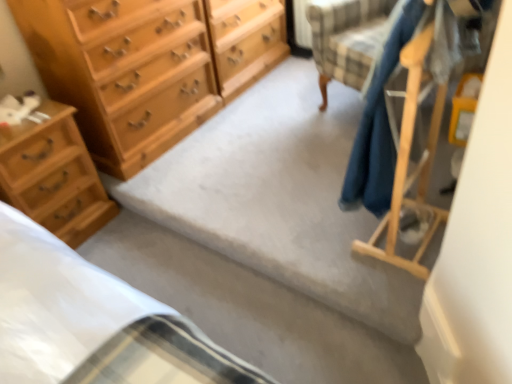
Image resolution: width=512 pixels, height=384 pixels. I want to click on light brown wood chest of drawers at left, the second chest of drawers in the top-to-bottom sequence, so click(53, 176).

Image resolution: width=512 pixels, height=384 pixels. Find the location of `the chest of drawers that appears in front of the light wood chest of drawers at left, acting as the second chest of drawers starting from the bottom`. the chest of drawers that appears in front of the light wood chest of drawers at left, acting as the second chest of drawers starting from the bottom is located at coordinates (53, 176).

Between point (137, 143) and point (53, 222), which one is positioned in front?

The point (53, 222) is closer to the camera.

Is light brown wood chest of drawers at left, the second chest of drawers in the top-to-bottom sequence, at the back of light wood chest of drawers at left, acting as the second chest of drawers starting from the bottom?

light wood chest of drawers at left, acting as the second chest of drawers starting from the bottom, is not turned away from light brown wood chest of drawers at left, the second chest of drawers in the top-to-bottom sequence.

Who is taller, wooden coat rack at right or light brown wood chest of drawers at left, the second chest of drawers in the top-to-bottom sequence?

wooden coat rack at right is taller.

Can you confirm if wooden coat rack at right is thinner than light brown wood chest of drawers at left, the 1th chest of drawers from the bottom?

No, wooden coat rack at right is not thinner than light brown wood chest of drawers at left, the 1th chest of drawers from the bottom.

From the image's perspective, is wooden coat rack at right positioned above or below light brown wood chest of drawers at left, the 1th chest of drawers from the bottom?

Based on their image positions, wooden coat rack at right is located above light brown wood chest of drawers at left, the 1th chest of drawers from the bottom.

Is light brown wood chest of drawers at left, the second chest of drawers in the top-to-bottom sequence, in front of or behind wooden coat rack at right in the image?

light brown wood chest of drawers at left, the second chest of drawers in the top-to-bottom sequence, is behind wooden coat rack at right.

Which point is more distant from viewer, (22, 185) or (386, 238)?

The point (22, 185) is behind.

Is light brown wood chest of drawers at left, the second chest of drawers in the top-to-bottom sequence, in contact with wooden coat rack at right?

No.

What's the angular difference between light brown wood chest of drawers at left, the second chest of drawers in the top-to-bottom sequence, and wooden coat rack at right's facing directions?

The angle between the facing direction of light brown wood chest of drawers at left, the second chest of drawers in the top-to-bottom sequence, and the facing direction of wooden coat rack at right is 178 degrees.

Does point (424, 200) come in front of point (306, 183)?

That is True.

Image resolution: width=512 pixels, height=384 pixels. Identify the location of concrete behind the wooden coat rack at right. (280, 197).

From the image's perspective, would you say wooden coat rack at right is positioned over carpet at center?

No, from the image's perspective, wooden coat rack at right is not on top of carpet at center.

Is light wood chest of drawers at left, the first chest of drawers in the top-to-bottom sequence, with wooden coat rack at right?

light wood chest of drawers at left, the first chest of drawers in the top-to-bottom sequence, is not next to wooden coat rack at right, and they're not touching.

Considering the sizes of light wood chest of drawers at left, the first chest of drawers in the top-to-bottom sequence, and wooden coat rack at right in the image, is light wood chest of drawers at left, the first chest of drawers in the top-to-bottom sequence, bigger or smaller than wooden coat rack at right?

In the image, light wood chest of drawers at left, the first chest of drawers in the top-to-bottom sequence, appears to be larger than wooden coat rack at right.

Consider the image. Can you tell me how much light wood chest of drawers at left, acting as the second chest of drawers starting from the bottom, and wooden coat rack at right differ in facing direction?

The angle between the facing direction of light wood chest of drawers at left, acting as the second chest of drawers starting from the bottom, and the facing direction of wooden coat rack at right is 178 degrees.

Is light wood chest of drawers at left, the first chest of drawers in the top-to-bottom sequence, not within wooden coat rack at right?

light wood chest of drawers at left, the first chest of drawers in the top-to-bottom sequence, lies outside wooden coat rack at right's area.

From a real-world perspective, is light brown wood chest of drawers at left, the second chest of drawers in the top-to-bottom sequence, on top of carpet at center?

Indeed, from a real-world perspective, light brown wood chest of drawers at left, the second chest of drawers in the top-to-bottom sequence, stands above carpet at center.

Is light brown wood chest of drawers at left, the 1th chest of drawers from the bottom, in front of or behind carpet at center in the image?

light brown wood chest of drawers at left, the 1th chest of drawers from the bottom, is positioned farther from the viewer than carpet at center.

Could carpet at center be considered to be inside light brown wood chest of drawers at left, the second chest of drawers in the top-to-bottom sequence?

No, carpet at center is not a part of light brown wood chest of drawers at left, the second chest of drawers in the top-to-bottom sequence.

Between light brown wood chest of drawers at left, the second chest of drawers in the top-to-bottom sequence, and carpet at center, which one has less height?

Standing shorter between the two is carpet at center.

How different are the orientations of wooden coat rack at right and light wood chest of drawers at left, the first chest of drawers in the top-to-bottom sequence, in degrees?

They differ by 178 degrees in their facing directions.

Is wooden coat rack at right aimed at light wood chest of drawers at left, the first chest of drawers in the top-to-bottom sequence?

Yes, wooden coat rack at right is aimed at light wood chest of drawers at left, the first chest of drawers in the top-to-bottom sequence.

From a real-world perspective, is wooden coat rack at right on top of light wood chest of drawers at left, the first chest of drawers in the top-to-bottom sequence?

Correct, in the physical world, wooden coat rack at right is higher than light wood chest of drawers at left, the first chest of drawers in the top-to-bottom sequence.

Identify the location of the chest of drawers above the light brown wood chest of drawers at left, the 1th chest of drawers from the bottom (from a real-world perspective). (147, 67).

Locate an element on the screen. Image resolution: width=512 pixels, height=384 pixels. furniture that appears in front of the light brown wood chest of drawers at left, the 1th chest of drawers from the bottom is located at coordinates (408, 162).

When comparing their distances from light brown wood chest of drawers at left, the second chest of drawers in the top-to-bottom sequence, does wooden coat rack at right or light wood chest of drawers at left, acting as the second chest of drawers starting from the bottom, seem further?

The object further to light brown wood chest of drawers at left, the second chest of drawers in the top-to-bottom sequence, is wooden coat rack at right.

From the image, which object appears to be nearer to carpet at center, light wood chest of drawers at left, acting as the second chest of drawers starting from the bottom, or light brown wood chest of drawers at left, the second chest of drawers in the top-to-bottom sequence?

light wood chest of drawers at left, acting as the second chest of drawers starting from the bottom, is closer to carpet at center.

Considering their positions, is light wood chest of drawers at left, acting as the second chest of drawers starting from the bottom, positioned further to wooden coat rack at right than light brown wood chest of drawers at left, the 1th chest of drawers from the bottom?

Among the two, light wood chest of drawers at left, acting as the second chest of drawers starting from the bottom, is located further to wooden coat rack at right.

Estimate the real-world distances between objects in this image. Which object is further from light wood chest of drawers at left, the first chest of drawers in the top-to-bottom sequence, carpet at center or light brown wood chest of drawers at left, the 1th chest of drawers from the bottom?

carpet at center is positioned further to the anchor light wood chest of drawers at left, the first chest of drawers in the top-to-bottom sequence.

From the image, which object appears to be farther from light brown wood chest of drawers at left, the 1th chest of drawers from the bottom, carpet at center or light wood chest of drawers at left, the first chest of drawers in the top-to-bottom sequence?

carpet at center.

Looking at the image, which one is located closer to light brown wood chest of drawers at left, the second chest of drawers in the top-to-bottom sequence, carpet at center or wooden coat rack at right?

Among the two, carpet at center is located nearer to light brown wood chest of drawers at left, the second chest of drawers in the top-to-bottom sequence.

Looking at the image, which one is located further to carpet at center, light brown wood chest of drawers at left, the second chest of drawers in the top-to-bottom sequence, or wooden coat rack at right?

The object further to carpet at center is light brown wood chest of drawers at left, the second chest of drawers in the top-to-bottom sequence.

Which object lies further to the anchor point wooden coat rack at right, light brown wood chest of drawers at left, the 1th chest of drawers from the bottom, or light wood chest of drawers at left, the first chest of drawers in the top-to-bottom sequence?

light wood chest of drawers at left, the first chest of drawers in the top-to-bottom sequence.

This screenshot has width=512, height=384. Find the location of `concrete located between light wood chest of drawers at left, the first chest of drawers in the top-to-bottom sequence, and wooden coat rack at right in the left-right direction`. concrete located between light wood chest of drawers at left, the first chest of drawers in the top-to-bottom sequence, and wooden coat rack at right in the left-right direction is located at coordinates (280, 197).

The width and height of the screenshot is (512, 384). Identify the location of the chest of drawers situated between light brown wood chest of drawers at left, the second chest of drawers in the top-to-bottom sequence, and carpet at center from left to right. (147, 67).

This screenshot has height=384, width=512. I want to click on concrete between light brown wood chest of drawers at left, the second chest of drawers in the top-to-bottom sequence, and wooden coat rack at right, in the horizontal direction, so click(280, 197).

Where is `chest of drawers between light brown wood chest of drawers at left, the 1th chest of drawers from the bottom, and wooden coat rack at right, in the horizontal direction`? This screenshot has height=384, width=512. chest of drawers between light brown wood chest of drawers at left, the 1th chest of drawers from the bottom, and wooden coat rack at right, in the horizontal direction is located at coordinates (147, 67).